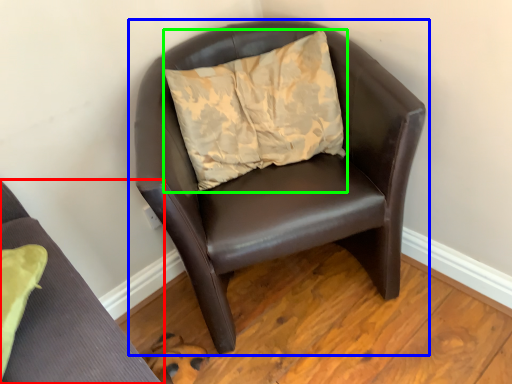
Question: Considering the real-world distances, which object is farthest from chair (highlighted by a red box)? chair (highlighted by a blue box) or pillow (highlighted by a green box)?

Choices:
 (A) chair
 (B) pillow

Answer: (B)